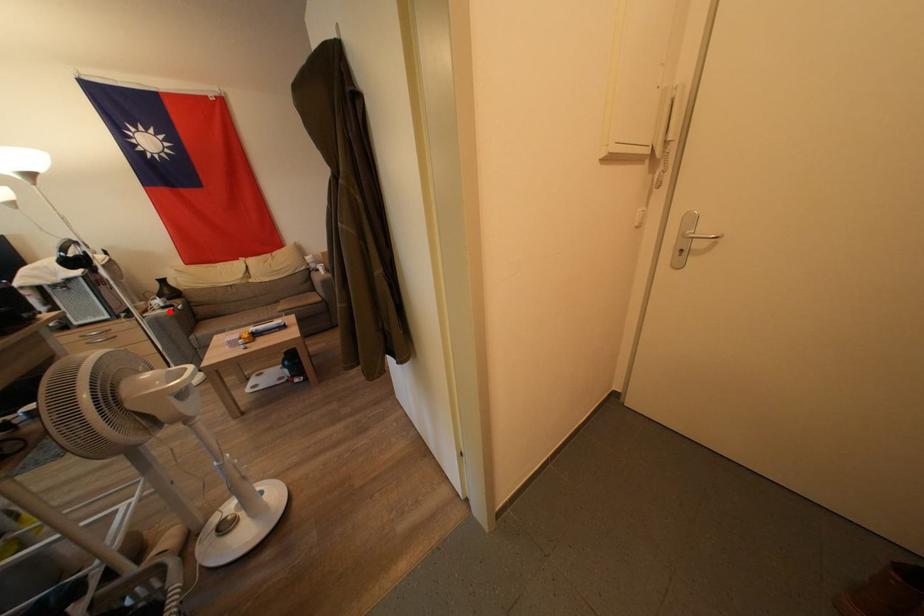
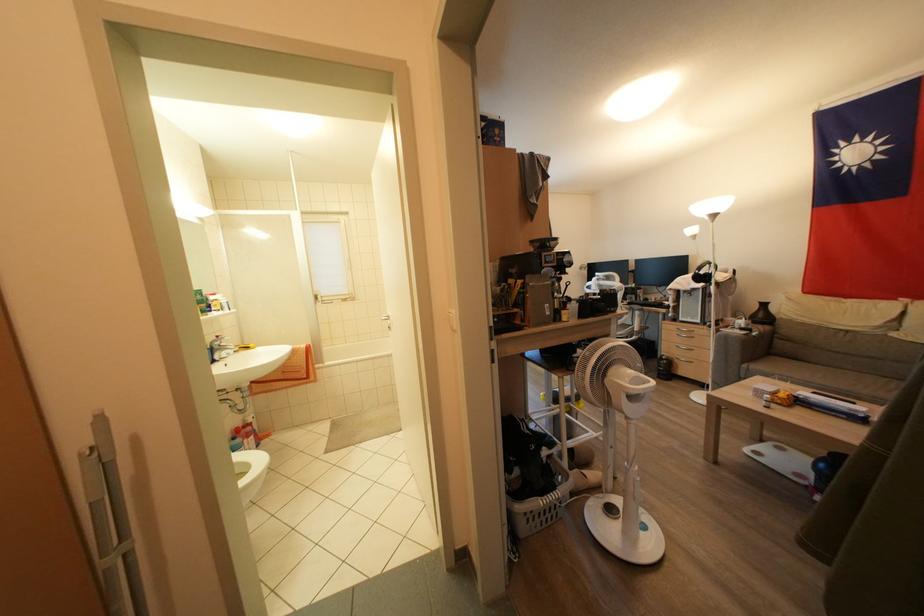
In the second image, find the point that corresponds to the highlighted location in the first image.

(747, 333)